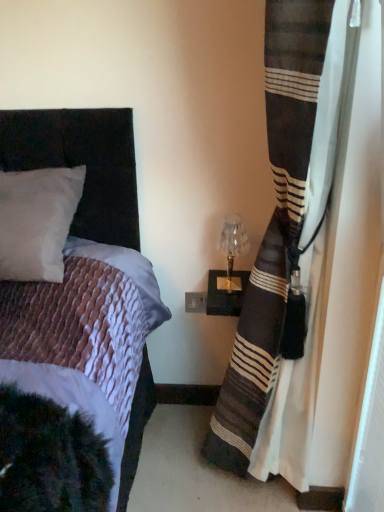
The width and height of the screenshot is (384, 512). I want to click on vacant space that is to the left of striped fabric curtain at right, so click(167, 474).